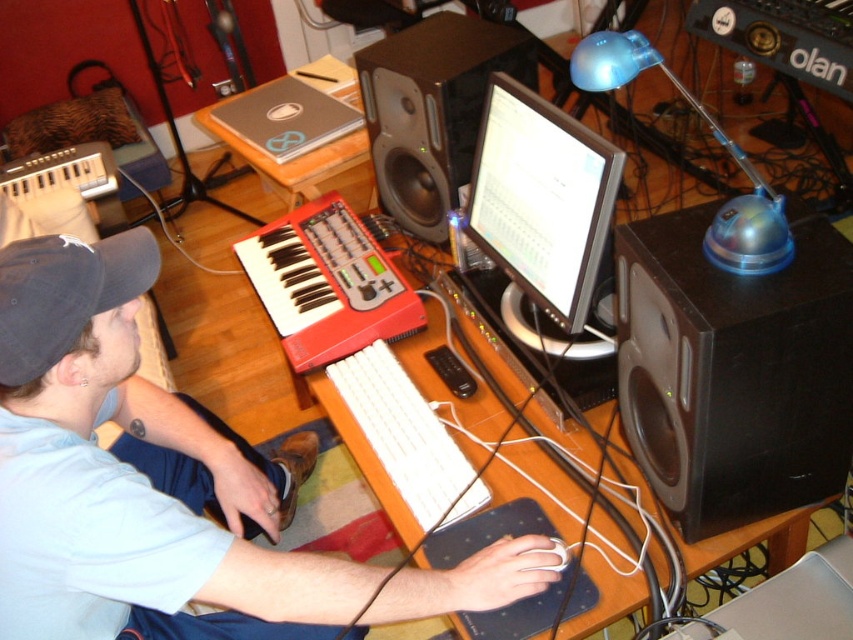
Question: From the image, what is the correct spatial relationship of matte black monitor at center in relation to black fabric baseball cap at left?

Choices:
 (A) left
 (B) right

Answer: (B)

Question: Which of these objects is positioned farthest from the black matte speaker at upper right?

Choices:
 (A) white matte mouse at lower center
 (B) matte black monitor at center

Answer: (A)

Question: Among these objects, which one is farthest from the camera?

Choices:
 (A) matte black monitor at center
 (B) black fabric baseball cap at left
 (C) white matte keyboard at center
 (D) black matte speaker at upper center

Answer: (D)

Question: Which object is farther from the camera taking this photo?

Choices:
 (A) matte black monitor at center
 (B) white matte mouse at lower center
 (C) black matte speaker at upper center
 (D) black fabric baseball cap at left

Answer: (C)

Question: Can you confirm if white matte keyboard at center is bigger than wooden table at upper center?

Choices:
 (A) yes
 (B) no

Answer: (A)

Question: Does matte black monitor at center appear on the right side of white matte mouse at lower center?

Choices:
 (A) yes
 (B) no

Answer: (B)